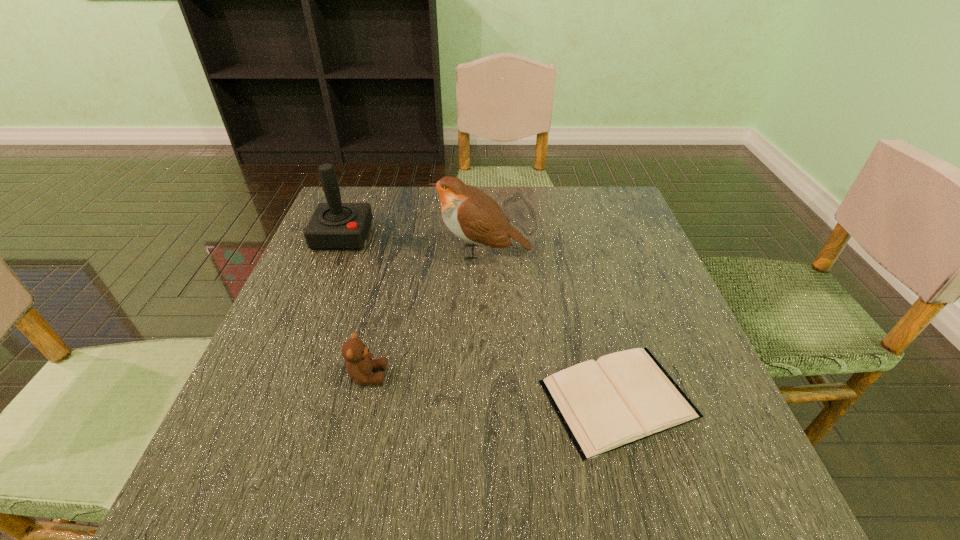
Identify the location of empty space that is in between the bird and the joystick. The height and width of the screenshot is (540, 960). (413, 244).

You are a GUI agent. You are given a task and a screenshot of the screen. Output one action in this format:
    pyautogui.click(x=<x>, y=<y>)
    Task: Click on the free space between the leftmost object and the bird
    The height and width of the screenshot is (540, 960).
    Given the screenshot: What is the action you would take?
    pyautogui.click(x=413, y=244)

Image resolution: width=960 pixels, height=540 pixels. I want to click on free point between the joystick and the hardback book, so click(x=480, y=318).

The height and width of the screenshot is (540, 960). I want to click on vacant area that lies between the shortest object and the third tallest object, so click(x=492, y=387).

Where is `the third closest object to the bird`? The image size is (960, 540). the third closest object to the bird is located at coordinates click(x=359, y=364).

At what (x,y) coordinates should I click in order to perform the action: click on object identified as the second closest to the hardback book. Please return your answer as a coordinate pair (x, y). Looking at the image, I should click on (359, 364).

Locate an element on the screen. vacant area in the image that satisfies the following two spatial constraints: 1. on the face of the teddy bear; 2. on the back side of the shortest object is located at coordinates (362, 399).

Find the location of `vacant region that satisfies the following two spatial constraints: 1. on the face of the shortest object; 2. on the left side of the third tallest object`. vacant region that satisfies the following two spatial constraints: 1. on the face of the shortest object; 2. on the left side of the third tallest object is located at coordinates (362, 399).

You are a GUI agent. You are given a task and a screenshot of the screen. Output one action in this format:
    pyautogui.click(x=<x>, y=<y>)
    Task: Click on the vacant space that satisfies the following two spatial constraints: 1. on the face of the hardback book; 2. on the right side of the third object from right to left
    Image resolution: width=960 pixels, height=540 pixels.
    Given the screenshot: What is the action you would take?
    pyautogui.click(x=362, y=399)

You are a GUI agent. You are given a task and a screenshot of the screen. Output one action in this format:
    pyautogui.click(x=<x>, y=<y>)
    Task: Click on the vacant position in the image that satisfies the following two spatial constraints: 1. at the face of the bird; 2. on the back side of the shortest object
    
    Given the screenshot: What is the action you would take?
    pyautogui.click(x=484, y=399)